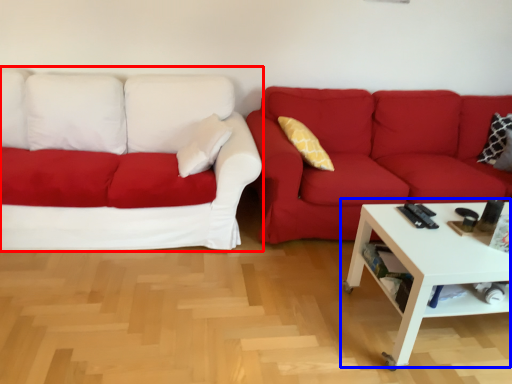
Question: Which object is further to the camera taking this photo, studio couch (highlighted by a red box) or coffee table (highlighted by a blue box)?

Choices:
 (A) studio couch
 (B) coffee table

Answer: (A)